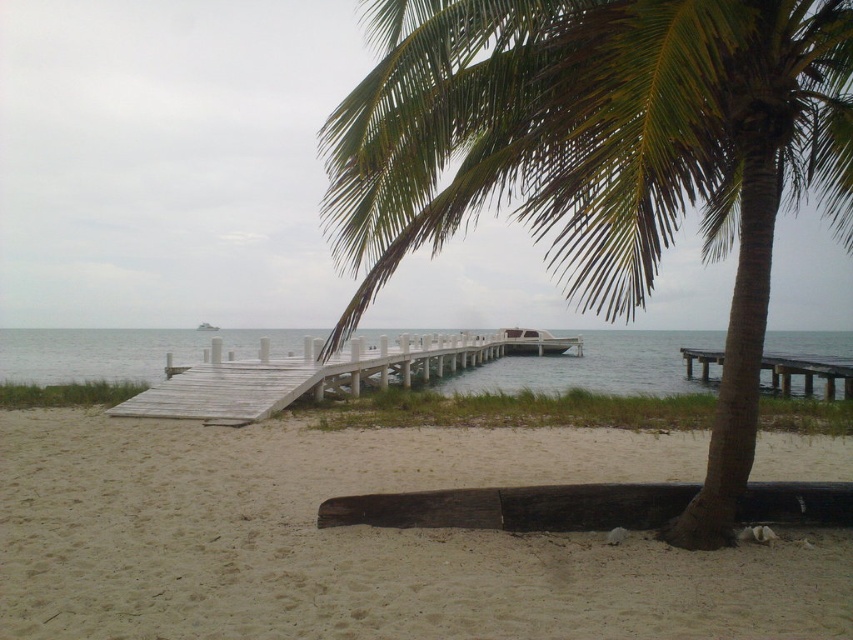
Is point (424, 576) positioned in front of point (242, 360)?

Yes, it is in front of point (242, 360).

Does sandy beach at lower left have a lesser width compared to white wooden dock at center?

Yes, sandy beach at lower left is thinner than white wooden dock at center.

Measure the distance between sandy beach at lower left and camera.

sandy beach at lower left is 4.40 meters away from camera.

Identify the location of sandy beach at lower left. The image size is (853, 640). (364, 540).

Who is more distant from viewer, (579, 104) or (128, 403)?

Positioned behind is point (128, 403).

Does point (554, 65) come closer to viewer compared to point (335, 380)?

Yes.

This screenshot has width=853, height=640. I want to click on green leafy palm tree at center, so click(x=602, y=157).

Who is shorter, green leafy palm tree at center or clear blue water at center?

Standing shorter between the two is clear blue water at center.

Between point (553, 80) and point (53, 348), which one is positioned behind?

The point (53, 348) is behind.

The image size is (853, 640). In order to click on green leafy palm tree at center in this screenshot , I will do `click(602, 157)`.